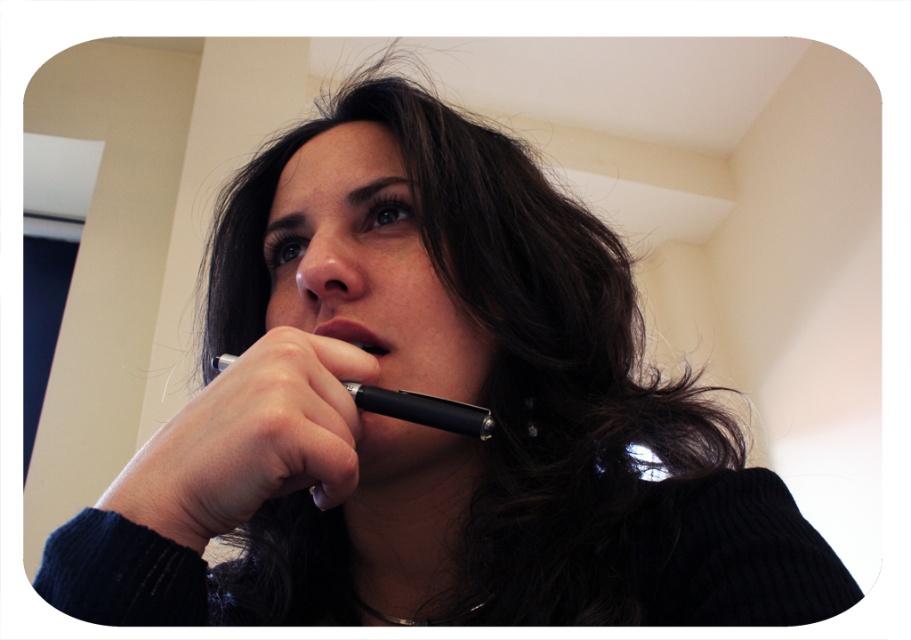
Which is behind, point (427, 403) or point (325, 330)?

The point (325, 330) is behind.

Can you confirm if black matte pen at lower center is positioned above pink matte lips at center?

Incorrect, black matte pen at lower center is not positioned above pink matte lips at center.

Which is behind, point (401, 397) or point (375, 336)?

The point (375, 336) is more distant.

Identify the location of black matte pen at lower center. (423, 410).

Does matte black nose at center lie in front of black matte pen at lower center?

No.

Describe the element at coordinates (324, 260) in the screenshot. I see `matte black nose at center` at that location.

I want to click on matte black nose at center, so click(x=324, y=260).

Can you confirm if matte black nose at center is positioned to the left of pink matte lips at center?

Yes, matte black nose at center is to the left of pink matte lips at center.

Which of these two, matte black nose at center or pink matte lips at center, stands taller?

Standing taller between the two is matte black nose at center.

Is point (322, 288) less distant than point (386, 352)?

Yes.

At what (x,y) coordinates should I click in order to perform the action: click on matte black nose at center. Please return your answer as a coordinate pair (x, y). This screenshot has width=911, height=640. Looking at the image, I should click on (324, 260).